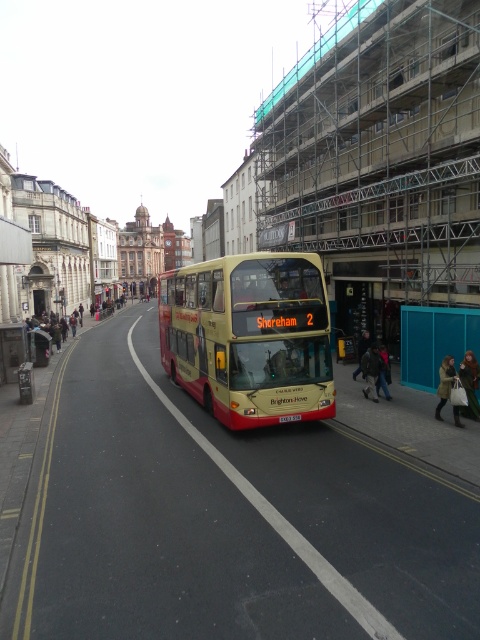
You are standing at the point labeled point (379, 356) and want to walk to the bus stop located at point (210, 269). Given that the bus is approaching from the direction of the yellow lines on the road, which direction should you turn to reach the bus stop?

You should turn towards the direction where point (210, 269) is located, which is in front of your current position at point (379, 356). Since the bus is approaching along the yellow lines, ensure you cross safely if needed.

What is located at the coordinates point (469,385)?

The green fabric coat at center is located at point (469,385).

You are a delivery person who needs to place a box between the green fabric coat at center and the teal fabric coat at lower right. Can you fit the box vertically if the box is 1.2 meters tall?

The green fabric coat at center is taller than the teal fabric coat at lower right. Since the box is 1.2 meters tall, it may not fit vertically between them if the space between the coats is less than 1.2 meters. However, without specific distance information between the coats, it is impossible to determine the exact feasibility.